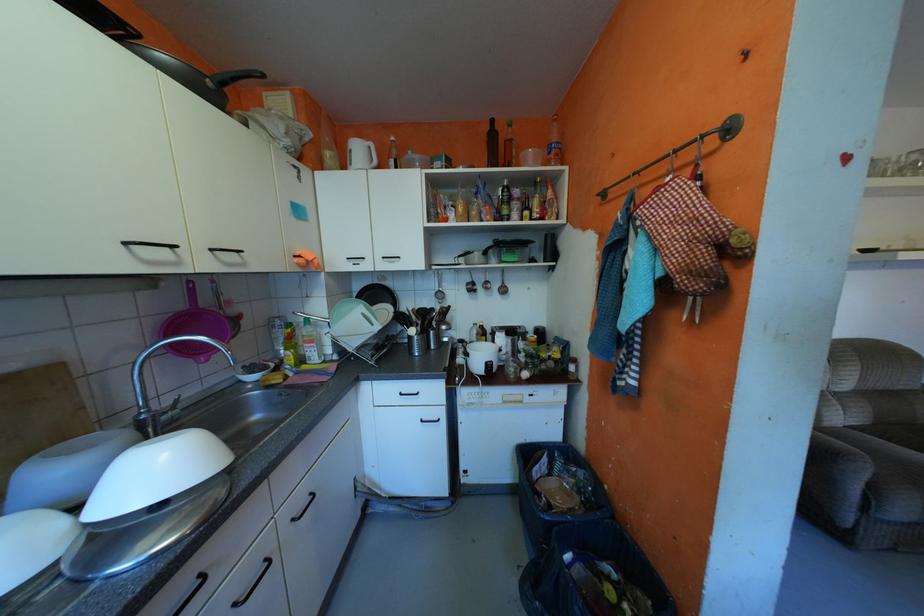
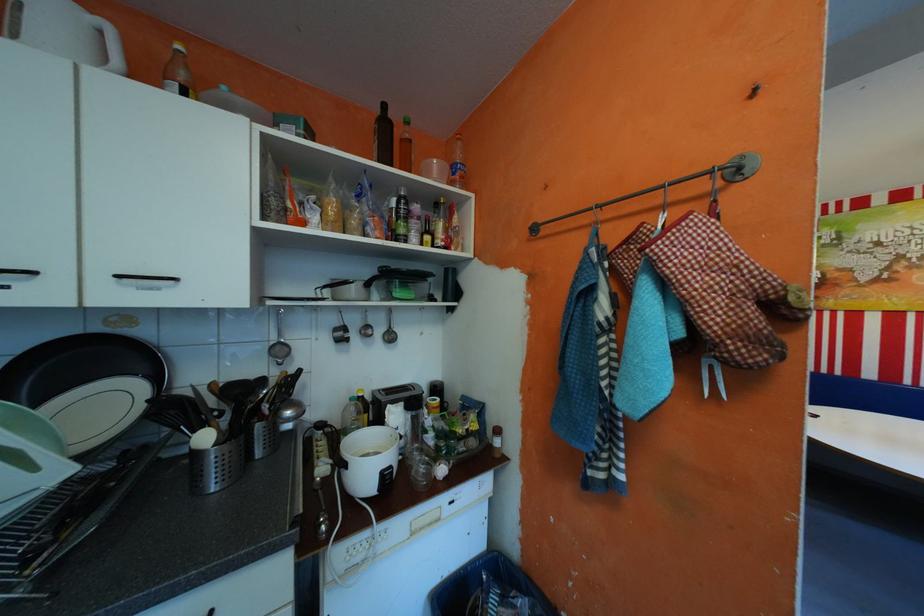
Where in the second image is the point corresponding to (x=451, y=293) from the first image?

(289, 346)